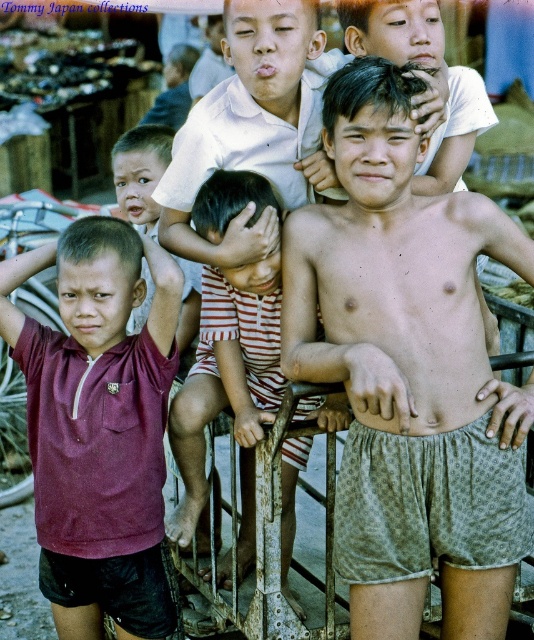
Which of these two, maroon jersey at left or striped cotton romper at center, stands shorter?

Standing shorter between the two is maroon jersey at left.

Identify the location of maroon jersey at left. (98, 385).

Can you confirm if patterned cotton shorts at center is positioned to the right of striped cotton romper at center?

Yes, patterned cotton shorts at center is to the right of striped cotton romper at center.

Looking at this image, which of these two, patterned cotton shorts at center or striped cotton romper at center, stands taller?

Standing taller between the two is patterned cotton shorts at center.

Which is in front, point (496, 582) or point (210, 180)?

Point (496, 582)

Where is `patterned cotton shorts at center`? patterned cotton shorts at center is located at coordinates (409, 371).

Can you confirm if patterned cotton shorts at center is thinner than maroon jersey at left?

No, patterned cotton shorts at center is not thinner than maroon jersey at left.

Where is `patterned cotton shorts at center`? Image resolution: width=534 pixels, height=640 pixels. patterned cotton shorts at center is located at coordinates (409, 371).

The height and width of the screenshot is (640, 534). Find the location of `patterned cotton shorts at center`. patterned cotton shorts at center is located at coordinates (409, 371).